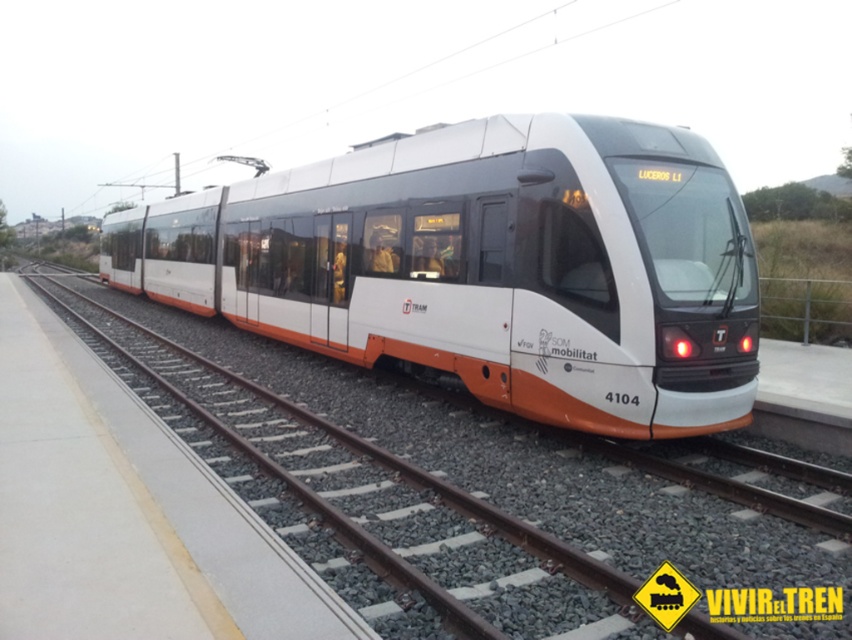
You are standing on the platform and want to walk from point (354,275) to point (501,582). Which direction should you move to get closer to the tram?

You should move towards the tram by moving away from point (354,275) and towards point (501,582) since point (354,275) is closer to you and point (501,582) is further away from you.

You are a maintenance worker inspecting the tram tracks. You notice the white matte train at center and the white metal track at center. Which object is positioned higher from the ground?

The white matte train at center is located above the white metal track at center, so it is positioned higher from the ground.